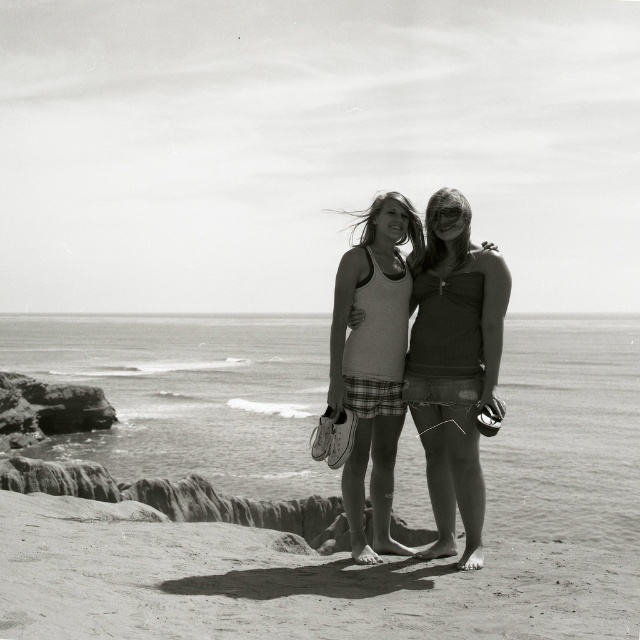
Question: Which point appears closest to the camera in this image?

Choices:
 (A) (474, 260)
 (B) (60, 548)

Answer: (B)

Question: Among these objects, which one is nearest to the camera?

Choices:
 (A) smooth sand at lower center
 (B) matte white tank top at center

Answer: (A)

Question: Does smooth sand at lower center come in front of matte white tank top at center?

Choices:
 (A) yes
 (B) no

Answer: (A)

Question: Does smooth sand at lower center have a smaller size compared to matte white tank top at center?

Choices:
 (A) no
 (B) yes

Answer: (A)

Question: Which point is closer to the camera taking this photo?

Choices:
 (A) (579, 609)
 (B) (493, 296)

Answer: (A)

Question: Can you confirm if smooth sand at lower center is positioned below matte white tank top at center?

Choices:
 (A) yes
 (B) no

Answer: (A)